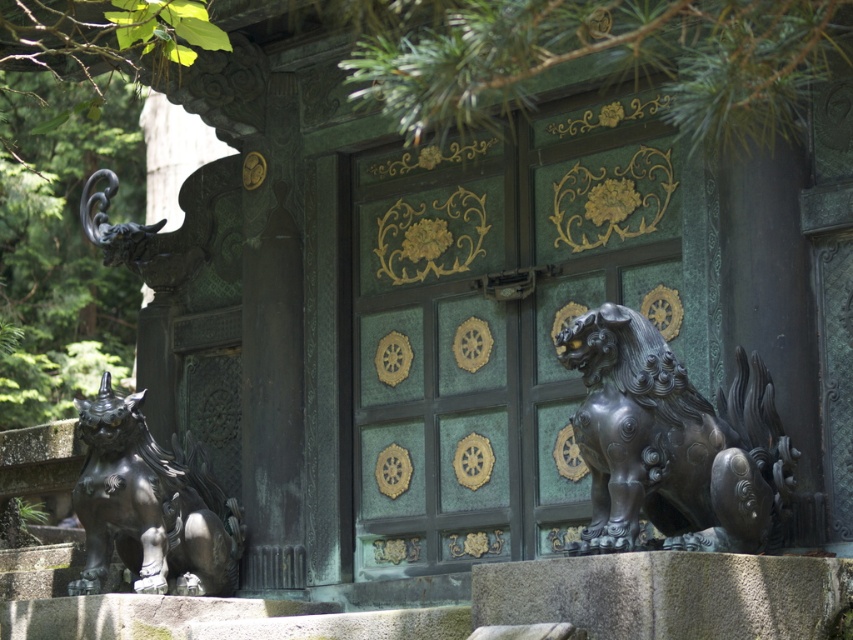
Question: Can you confirm if green patinated metal door at center is bigger than black polished stone lion at right?

Choices:
 (A) yes
 (B) no

Answer: (A)

Question: Does black polished stone lion at right come in front of bronze statue at lower left?

Choices:
 (A) yes
 (B) no

Answer: (A)

Question: Which of the following is the farthest from the observer?

Choices:
 (A) (635, 509)
 (B) (537, 531)

Answer: (B)

Question: Which of these objects is positioned farthest from the green patinated metal door at center?

Choices:
 (A) bronze statue at lower left
 (B) black polished stone lion at right

Answer: (B)

Question: In this image, where is green patinated metal door at center located relative to bronze statue at lower left?

Choices:
 (A) above
 (B) below

Answer: (A)

Question: Considering the real-world distances, which object is farthest from the green patinated metal door at center?

Choices:
 (A) bronze statue at lower left
 (B) black polished stone lion at right

Answer: (B)